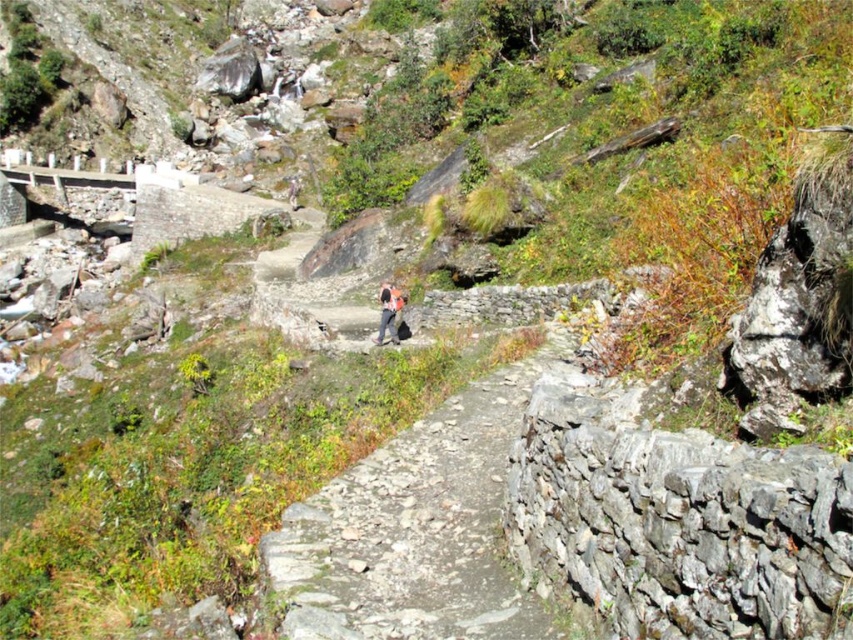
Does gray stone path at center appear under camouflage fabric backpack at center?

Correct, gray stone path at center is located below camouflage fabric backpack at center.

Locate an element on the screen. gray stone path at center is located at coordinates (419, 528).

At what (x,y) coordinates should I click in order to perform the action: click on gray stone path at center. Please return your answer as a coordinate pair (x, y). Looking at the image, I should click on (419, 528).